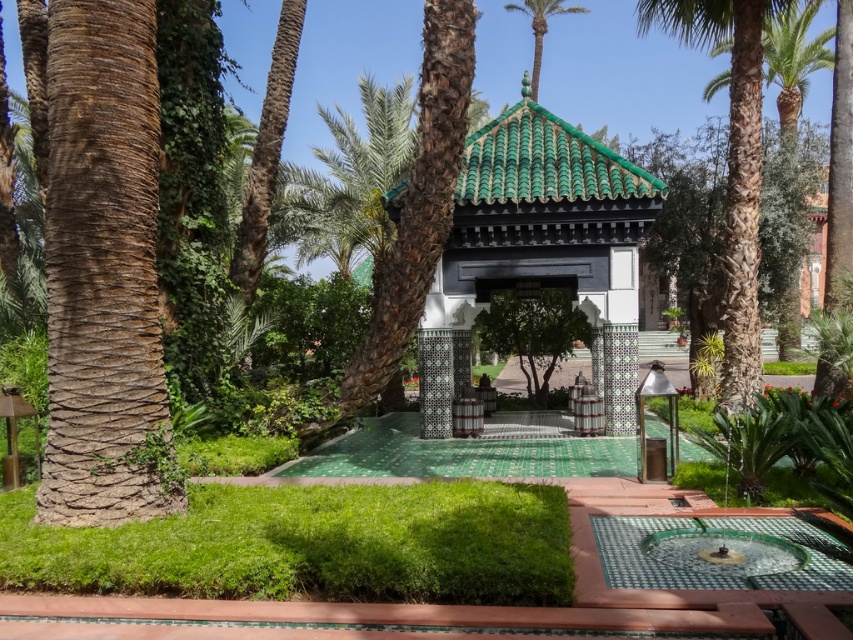
Question: Can you confirm if brown rough bark palm at left is positioned above green lush grass at lower left?

Choices:
 (A) yes
 (B) no

Answer: (A)

Question: Among these objects, which one is nearest to the camera?

Choices:
 (A) green glazed tile gazebo at center
 (B) green leafy palm tree at upper center
 (C) green lush grass at lower left
 (D) green leafy palm tree at right

Answer: (C)

Question: Based on their relative distances, which object is nearer to the brown rough bark palm at left?

Choices:
 (A) green leafy palm tree at right
 (B) green lush grass at lower left
 (C) green leafy palm tree at upper center
 (D) green glazed tile gazebo at center

Answer: (B)

Question: Where is green lush grass at lower left located in relation to green leafy palm tree at upper center in the image?

Choices:
 (A) left
 (B) right

Answer: (A)

Question: Observing the image, what is the correct spatial positioning of green lush grass at lower left in reference to green glazed tile gazebo at center?

Choices:
 (A) right
 (B) left

Answer: (B)

Question: Considering the real-world distances, which object is farthest from the green leafy palm tree at right?

Choices:
 (A) green glazed tile gazebo at center
 (B) green leafy palm tree at upper center

Answer: (A)